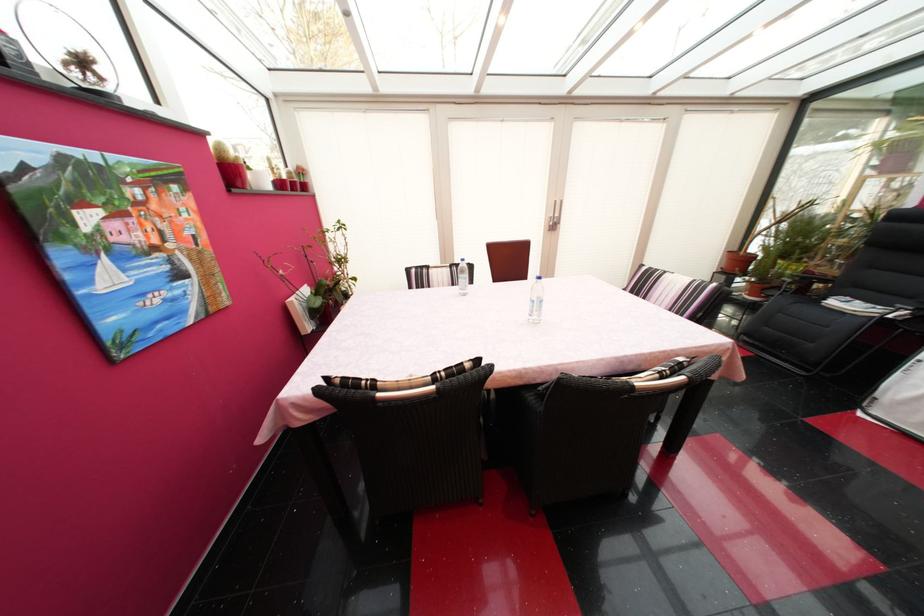
Find the location of a particular element. magazine on chair is located at coordinates coord(862,307).